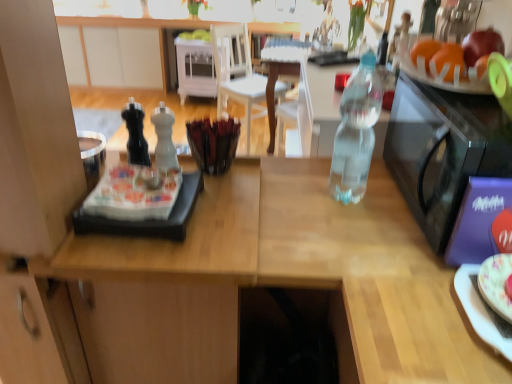
Find the location of a particular element. This screenshot has width=512, height=384. vacant space to the right of white matte pepper shaker at center, the 2th bottle viewed from the left is located at coordinates (242, 183).